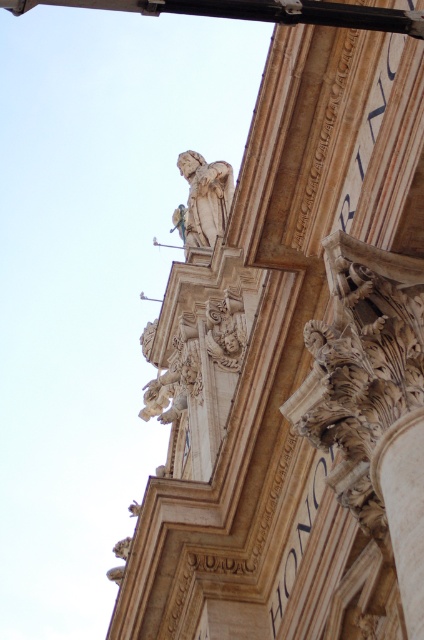
Does white stone column at lower right have a lesser height compared to black metal pole at upper center?

In fact, white stone column at lower right may be taller than black metal pole at upper center.

Is white stone column at lower right further to camera compared to black metal pole at upper center?

Yes, white stone column at lower right is behind black metal pole at upper center.

This screenshot has height=640, width=424. I want to click on white stone column at lower right, so click(x=404, y=508).

Image resolution: width=424 pixels, height=640 pixels. In order to click on white stone column at lower right in this screenshot , I will do `click(404, 508)`.

Can you confirm if white marble statue at upper center is bigger than white marble sculpture at center?

Yes, white marble statue at upper center is bigger than white marble sculpture at center.

Does white marble statue at upper center appear on the right side of white marble sculpture at center?

Incorrect, white marble statue at upper center is not on the right side of white marble sculpture at center.

Which is behind, point (175, 214) or point (206, 301)?

The point (175, 214) is more distant.

Identify the location of white marble statue at upper center. Image resolution: width=424 pixels, height=640 pixels. (203, 198).

Is black metal pole at upper center below white marble sculpture at center?

Incorrect, black metal pole at upper center is not positioned below white marble sculpture at center.

Can you confirm if black metal pole at upper center is positioned to the left of white marble sculpture at center?

Correct, you'll find black metal pole at upper center to the left of white marble sculpture at center.

At what (x,y) coordinates should I click in order to perform the action: click on black metal pole at upper center. Please return your answer as a coordinate pair (x, y). Looking at the image, I should click on (256, 12).

At what (x,y) coordinates should I click in order to perform the action: click on black metal pole at upper center. Please return your answer as a coordinate pair (x, y). The height and width of the screenshot is (640, 424). Looking at the image, I should click on (256, 12).